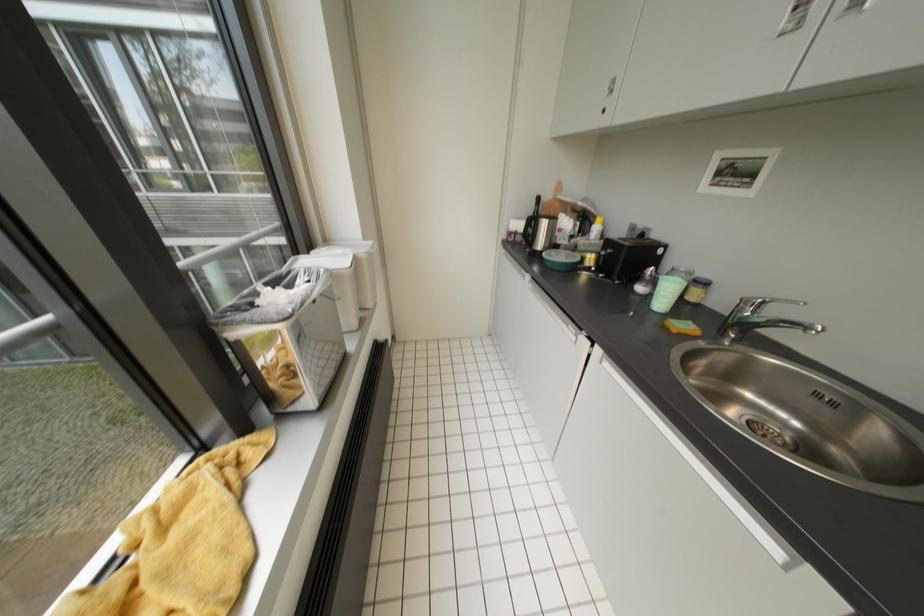
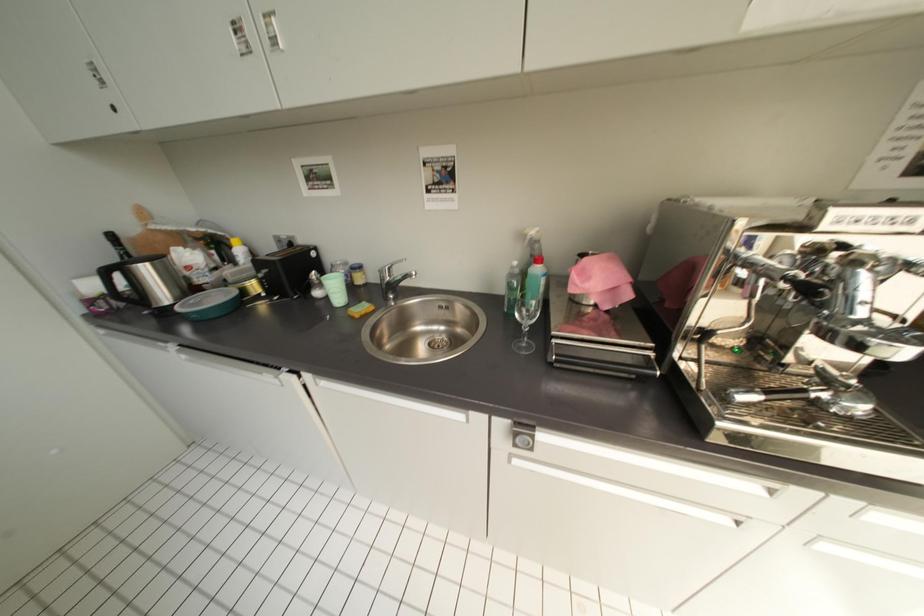
Question: The camera is either moving clockwise (left) or counter-clockwise (right) around the object. The first image is from the beginning of the video and the second image is from the end. Is the camera moving left or right when shooting the video?

Choices:
 (A) Left
 (B) Right

Answer: (A)